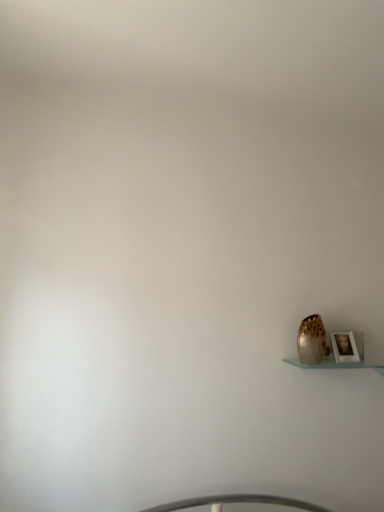
Question: From the image's perspective, is wooden photo frame at lower right located above or below speckled ceramic vase at lower right?

Choices:
 (A) above
 (B) below

Answer: (B)

Question: Visually, is wooden photo frame at lower right positioned to the left or to the right of speckled ceramic vase at lower right?

Choices:
 (A) right
 (B) left

Answer: (A)

Question: Based on their sizes in the image, would you say wooden photo frame at lower right is bigger or smaller than speckled ceramic vase at lower right?

Choices:
 (A) small
 (B) big

Answer: (A)

Question: From the image's perspective, relative to wooden photo frame at lower right, is speckled ceramic vase at lower right above or below?

Choices:
 (A) below
 (B) above

Answer: (B)

Question: In terms of height, does speckled ceramic vase at lower right look taller or shorter compared to wooden photo frame at lower right?

Choices:
 (A) tall
 (B) short

Answer: (A)

Question: Looking at their shapes, would you say speckled ceramic vase at lower right is wider or thinner than wooden photo frame at lower right?

Choices:
 (A) thin
 (B) wide

Answer: (B)

Question: Is speckled ceramic vase at lower right inside or outside of wooden photo frame at lower right?

Choices:
 (A) outside
 (B) inside

Answer: (A)